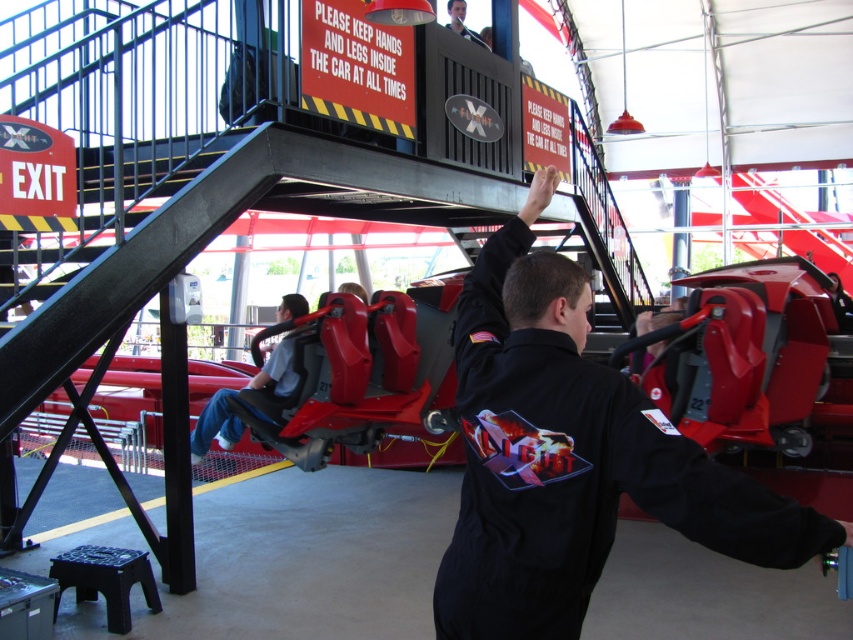
Does black matte uniform at center lie behind gray fabric seat at lower center?

No, black matte uniform at center is in front of gray fabric seat at lower center.

Who is taller, black matte uniform at center or gray fabric seat at lower center?

With more height is black matte uniform at center.

The image size is (853, 640). Describe the element at coordinates (572, 456) in the screenshot. I see `black matte uniform at center` at that location.

Locate an element on the screen. The image size is (853, 640). black matte uniform at center is located at coordinates (572, 456).

Does gray fabric seat at lower center appear on the right side of smooth black shirt at center?

Incorrect, gray fabric seat at lower center is not on the right side of smooth black shirt at center.

Based on the photo, does gray fabric seat at lower center appear over smooth black shirt at center?

Actually, gray fabric seat at lower center is below smooth black shirt at center.

Which is in front, point (265, 385) or point (456, 12)?

Point (265, 385)

Where is `gray fabric seat at lower center`? gray fabric seat at lower center is located at coordinates (215, 426).

Between point (601, 432) and point (460, 16), which one is positioned behind?

The point (460, 16) is behind.

Who is more forward, [631,403] or [463,22]?

Point [631,403] is in front.

You are a GUI agent. You are given a task and a screenshot of the screen. Output one action in this format:
    pyautogui.click(x=<x>, y=<y>)
    Task: Click on the black matte uniform at center
    The image size is (853, 640).
    Given the screenshot: What is the action you would take?
    pyautogui.click(x=572, y=456)